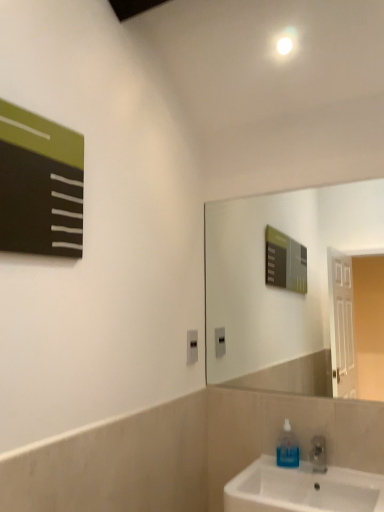
The width and height of the screenshot is (384, 512). Describe the element at coordinates (40, 185) in the screenshot. I see `matte black board at upper left` at that location.

Where is `black plastic outlet at center`? The width and height of the screenshot is (384, 512). black plastic outlet at center is located at coordinates (192, 346).

From a real-world perspective, which object stands above the other?

matte black board at upper left.

From the image's perspective, is matte black board at upper left on top of transparent blue liquid at sink right?

Yes.

In the image, is matte black board at upper left positioned in front of or behind transparent blue liquid at sink right?

Clearly, matte black board at upper left is in front of transparent blue liquid at sink right.

Is matte black board at upper left shorter than transparent blue liquid at sink right?

Incorrect, the height of matte black board at upper left does not fall short of that of transparent blue liquid at sink right.

Looking at this image, does black plastic outlet at center appear on the left side of white glossy sink at lower right?

Correct, you'll find black plastic outlet at center to the left of white glossy sink at lower right.

Is black plastic outlet at center positioned with its back to white glossy sink at lower right?

No, white glossy sink at lower right is not at the back of black plastic outlet at center.

Can you see black plastic outlet at center touching white glossy sink at lower right?

No, black plastic outlet at center is not next to white glossy sink at lower right.

From the image's perspective, would you say black plastic outlet at center is positioned over white glossy sink at lower right?

Yes.

From a real-world perspective, between transparent blue liquid at sink right and black plastic outlet at center, who is vertically higher?

black plastic outlet at center, from a real-world perspective.

Can you see transparent blue liquid at sink right touching black plastic outlet at center?

No, transparent blue liquid at sink right is not making contact with black plastic outlet at center.

From the image's perspective, is transparent blue liquid at sink right above or below black plastic outlet at center?

From the image's perspective, transparent blue liquid at sink right appears below black plastic outlet at center.

Does transparent blue liquid at sink right have a larger size compared to black plastic outlet at center?

Indeed, transparent blue liquid at sink right has a larger size compared to black plastic outlet at center.

Considering the points (329, 501) and (194, 333), which point is behind, point (329, 501) or point (194, 333)?

The point (194, 333) is farther from the camera.

Considering the sizes of objects white glossy sink at lower right and black plastic outlet at center in the image provided, who is bigger, white glossy sink at lower right or black plastic outlet at center?

Bigger between the two is white glossy sink at lower right.

Is white glossy sink at lower right in contact with black plastic outlet at center?

No, white glossy sink at lower right is not with black plastic outlet at center.

Which of these two, white glossy sink at lower right or black plastic outlet at center, stands taller?

→ With more height is white glossy sink at lower right.

Considering the sizes of objects matte black board at upper left and white glossy sink at lower right in the image provided, who is smaller, matte black board at upper left or white glossy sink at lower right?

With smaller size is matte black board at upper left.

Consider the image. Which object is further away from the camera taking this photo, matte black board at upper left or white glossy sink at lower right?

white glossy sink at lower right is further from the camera.

Can you tell me how much matte black board at upper left and white glossy sink at lower right differ in facing direction?

The angular difference between matte black board at upper left and white glossy sink at lower right is 89.8 degrees.

Between matte black board at upper left and white glossy sink at lower right, which one has smaller width?

Thinner between the two is matte black board at upper left.

From the image's perspective, relative to transparent blue liquid at sink right, is black plastic outlet at center above or below?

Based on their image positions, black plastic outlet at center is located above transparent blue liquid at sink right.

Based on the photo, does black plastic outlet at center have a lesser width compared to transparent blue liquid at sink right?

Indeed, black plastic outlet at center has a lesser width compared to transparent blue liquid at sink right.

You are a GUI agent. You are given a task and a screenshot of the screen. Output one action in this format:
    pyautogui.click(x=<x>, y=<y>)
    Task: Click on the soap dispenser lying on the right of black plastic outlet at center
    
    Given the screenshot: What is the action you would take?
    pyautogui.click(x=288, y=448)

Is point (195, 336) farther from camera compared to point (295, 448)?

Yes, it is behind point (295, 448).

Is point (307, 505) farther from camera compared to point (12, 127)?

Yes, point (307, 505) is farther from viewer.

Can you confirm if white glossy sink at lower right is thinner than matte black board at upper left?

In fact, white glossy sink at lower right might be wider than matte black board at upper left.

How many degrees apart are the facing directions of white glossy sink at lower right and matte black board at upper left?

The facing directions of white glossy sink at lower right and matte black board at upper left are 89.8 degrees apart.

From the picture: From the image's perspective, which one is positioned lower, white glossy sink at lower right or matte black board at upper left?

white glossy sink at lower right.

This screenshot has width=384, height=512. Identify the location of bulletin board that appears in front of the transparent blue liquid at sink right. (40, 185).

Identify the location of sink that appears below the black plastic outlet at center (from the image's perspective). (303, 489).

In the scene shown: Which object lies nearer to the anchor point transparent blue liquid at sink right, white glossy sink at lower right or black plastic outlet at center?

Among the two, white glossy sink at lower right is located nearer to transparent blue liquid at sink right.

Consider the image. Based on their spatial positions, is black plastic outlet at center or matte black board at upper left closer to white glossy sink at lower right?

The object closer to white glossy sink at lower right is black plastic outlet at center.

Considering their positions, is white glossy sink at lower right positioned closer to matte black board at upper left than transparent blue liquid at sink right?

white glossy sink at lower right.

Looking at this image, which object lies nearer to the anchor point black plastic outlet at center, white glossy sink at lower right or matte black board at upper left?

Among the two, white glossy sink at lower right is located nearer to black plastic outlet at center.

Estimate the real-world distances between objects in this image. Which object is further from matte black board at upper left, black plastic outlet at center or white glossy sink at lower right?

white glossy sink at lower right.

When comparing their distances from transparent blue liquid at sink right, does black plastic outlet at center or matte black board at upper left seem further?

The object further to transparent blue liquid at sink right is matte black board at upper left.

Based on their spatial positions, is transparent blue liquid at sink right or white glossy sink at lower right further from matte black board at upper left?

The object further to matte black board at upper left is transparent blue liquid at sink right.

When comparing their distances from white glossy sink at lower right, does matte black board at upper left or black plastic outlet at center seem further?

matte black board at upper left is further to white glossy sink at lower right.

This screenshot has height=512, width=384. I want to click on soap dispenser between matte black board at upper left and white glossy sink at lower right in the up-down direction, so coord(288,448).

Locate an element on the screen. This screenshot has height=512, width=384. electric outlet that lies between matte black board at upper left and transparent blue liquid at sink right from top to bottom is located at coordinates (192, 346).

Find the location of a particular element. The image size is (384, 512). soap dispenser between white glossy sink at lower right and black plastic outlet at center in the front-back direction is located at coordinates (288, 448).

The height and width of the screenshot is (512, 384). I want to click on electric outlet between matte black board at upper left and white glossy sink at lower right in the vertical direction, so click(192, 346).